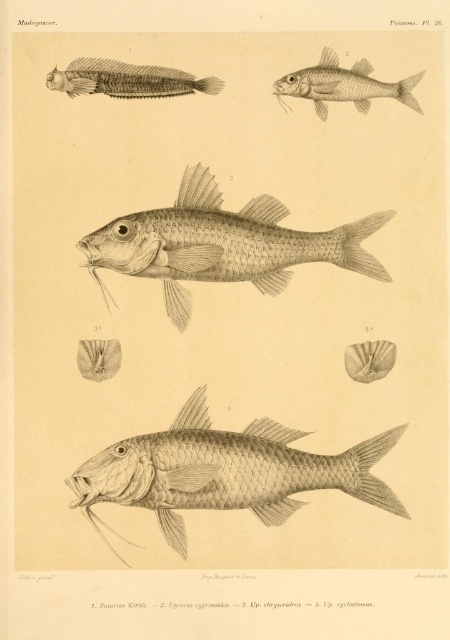
You are an underwater photographer aiming to capture both the gray textured fish at center and the grayish matte fish at center in a single photo. Which fish should you focus on to ensure the other remains in the background?

You should focus on the gray textured fish at center because it is in front of the grayish matte fish at center, so the latter will naturally be in the background.